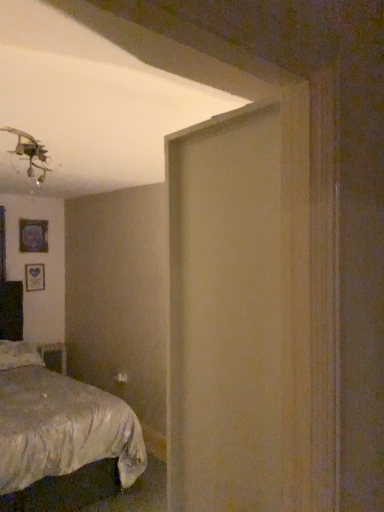
The height and width of the screenshot is (512, 384). What do you see at coordinates (33, 236) in the screenshot?
I see `matte black picture frame at upper left, the first picture frame from the top` at bounding box center [33, 236].

Measure the distance between silky white bed at lower left and camera.

The depth of silky white bed at lower left is 2.38 meters.

The width and height of the screenshot is (384, 512). Find the location of `white soft pillow at lower left`. white soft pillow at lower left is located at coordinates (19, 355).

Where is `matte black picture frame at upper left, which is counted as the second picture frame, starting from the bottom`? matte black picture frame at upper left, which is counted as the second picture frame, starting from the bottom is located at coordinates (33, 236).

Looking at this image, is silky white bed at lower left bigger than white soft pillow at lower left?

Yes.

Is silky white bed at lower left beside white soft pillow at lower left?

No, silky white bed at lower left is not in contact with white soft pillow at lower left.

Which object is closer to the camera, silky white bed at lower left or white soft pillow at lower left?

silky white bed at lower left is more forward.

Consider the image. From the image's perspective, which is above, silky white bed at lower left or white soft pillow at lower left?

silky white bed at lower left.

Looking at their sizes, would you say silky white bed at lower left is wider or thinner than wooden table at lower left?

In the image, silky white bed at lower left appears to be wider than wooden table at lower left.

Is silky white bed at lower left taller or shorter than wooden table at lower left?

silky white bed at lower left is taller than wooden table at lower left.

From a real-world perspective, is silky white bed at lower left below wooden table at lower left?

Incorrect, from a real-world perspective, silky white bed at lower left is higher than wooden table at lower left.

Can you tell me how much silky white bed at lower left and wooden table at lower left differ in facing direction?

The facing directions of silky white bed at lower left and wooden table at lower left are 0.782 degrees apart.

Is wooden picture frame at left, which appears as the first picture frame when ordered from the bottom, wider than silky white bed at lower left?

No.

In the scene shown: Is wooden picture frame at left, which appears as the first picture frame when ordered from the bottom, facing towards silky white bed at lower left?

No, wooden picture frame at left, which appears as the first picture frame when ordered from the bottom, is not facing towards silky white bed at lower left.

Which is more to the right, wooden picture frame at left, which is the second picture frame in top-to-bottom order, or silky white bed at lower left?

Positioned to the right is silky white bed at lower left.

From the image's perspective, is wooden table at lower left beneath silky white bed at lower left?

Correct, wooden table at lower left appears lower than silky white bed at lower left in the image.

The image size is (384, 512). Find the location of `bed above the wooden table at lower left (from the image's perspective)`. bed above the wooden table at lower left (from the image's perspective) is located at coordinates (62, 429).

Is white soft pillow at lower left wider than wooden picture frame at left, which is the second picture frame in top-to-bottom order?

Yes, white soft pillow at lower left is wider than wooden picture frame at left, which is the second picture frame in top-to-bottom order.

From the image's perspective, is white soft pillow at lower left over wooden picture frame at left, which appears as the first picture frame when ordered from the bottom?

Incorrect, from the image's perspective, white soft pillow at lower left is lower than wooden picture frame at left, which appears as the first picture frame when ordered from the bottom.

Is wooden picture frame at left, which is the second picture frame in top-to-bottom order, located within white soft pillow at lower left?

No.

Between white soft pillow at lower left and wooden picture frame at left, which is the second picture frame in top-to-bottom order, which one has larger size?

Bigger between the two is white soft pillow at lower left.

Find the location of `the 1st picture frame to the left of the silky white bed at lower left, starting your count from the anchor`. the 1st picture frame to the left of the silky white bed at lower left, starting your count from the anchor is located at coordinates (34, 277).

Visually, is silky white bed at lower left positioned to the left or to the right of wooden picture frame at left, which is the second picture frame in top-to-bottom order?

From the image, it's evident that silky white bed at lower left is to the right of wooden picture frame at left, which is the second picture frame in top-to-bottom order.

Does silky white bed at lower left come behind wooden picture frame at left, which appears as the first picture frame when ordered from the bottom?

No, the depth of silky white bed at lower left is less than that of wooden picture frame at left, which appears as the first picture frame when ordered from the bottom.

Which point is more forward, (29, 481) or (27, 283)?

Positioned in front is point (29, 481).

Which is in front, white soft pillow at lower left or matte black picture frame at upper left, which is counted as the second picture frame, starting from the bottom?

white soft pillow at lower left is in front.

Based on the photo, which object is wider, white soft pillow at lower left or matte black picture frame at upper left, which is counted as the second picture frame, starting from the bottom?

With larger width is white soft pillow at lower left.

Is matte black picture frame at upper left, which is counted as the second picture frame, starting from the bottom, located within white soft pillow at lower left?

Actually, matte black picture frame at upper left, which is counted as the second picture frame, starting from the bottom, is outside white soft pillow at lower left.

From the picture: Would you say white soft pillow at lower left is a long distance from matte black picture frame at upper left, the first picture frame from the top?

That's right, there is a large distance between white soft pillow at lower left and matte black picture frame at upper left, the first picture frame from the top.

You are a GUI agent. You are given a task and a screenshot of the screen. Output one action in this format:
    pyautogui.click(x=<x>, y=<y>)
    Task: Click on the pillow behind the silky white bed at lower left
    This screenshot has width=384, height=512.
    Given the screenshot: What is the action you would take?
    19,355

Where is `bed positioned vertically above the wooden table at lower left (from a real-world perspective)`? bed positioned vertically above the wooden table at lower left (from a real-world perspective) is located at coordinates (62, 429).

When comparing their distances from silky white bed at lower left, does wooden table at lower left or matte black picture frame at upper left, the first picture frame from the top, seem further?

matte black picture frame at upper left, the first picture frame from the top, is positioned further to the anchor silky white bed at lower left.

Looking at the image, which one is located closer to white soft pillow at lower left, wooden table at lower left or matte black picture frame at upper left, the first picture frame from the top?

wooden table at lower left is positioned closer to the anchor white soft pillow at lower left.

Considering their positions, is white soft pillow at lower left positioned closer to wooden table at lower left than matte black picture frame at upper left, the first picture frame from the top?

Among the two, white soft pillow at lower left is located nearer to wooden table at lower left.

When comparing their distances from matte black picture frame at upper left, which is counted as the second picture frame, starting from the bottom, does silky white bed at lower left or white soft pillow at lower left seem closer?

white soft pillow at lower left.

Based on their spatial positions, is matte black picture frame at upper left, which is counted as the second picture frame, starting from the bottom, or silky white bed at lower left closer to white soft pillow at lower left?

silky white bed at lower left.

Which object lies further to the anchor point silky white bed at lower left, wooden picture frame at left, which appears as the first picture frame when ordered from the bottom, or wooden table at lower left?

The object further to silky white bed at lower left is wooden picture frame at left, which appears as the first picture frame when ordered from the bottom.

Which object lies further to the anchor point white soft pillow at lower left, matte black picture frame at upper left, which is counted as the second picture frame, starting from the bottom, or wooden picture frame at left, which appears as the first picture frame when ordered from the bottom?

The object further to white soft pillow at lower left is matte black picture frame at upper left, which is counted as the second picture frame, starting from the bottom.

Which object lies further to the anchor point wooden picture frame at left, which is the second picture frame in top-to-bottom order, white soft pillow at lower left or silky white bed at lower left?

The object further to wooden picture frame at left, which is the second picture frame in top-to-bottom order, is silky white bed at lower left.

Where is `picture frame that lies between matte black picture frame at upper left, which is counted as the second picture frame, starting from the bottom, and wooden table at lower left from top to bottom`? The width and height of the screenshot is (384, 512). picture frame that lies between matte black picture frame at upper left, which is counted as the second picture frame, starting from the bottom, and wooden table at lower left from top to bottom is located at coordinates (34, 277).

The width and height of the screenshot is (384, 512). In order to click on picture frame between matte black picture frame at upper left, which is counted as the second picture frame, starting from the bottom, and white soft pillow at lower left vertically in this screenshot , I will do `click(34, 277)`.

Identify the location of picture frame between silky white bed at lower left and wooden table at lower left from front to back. The width and height of the screenshot is (384, 512). (33, 236).

You are a GUI agent. You are given a task and a screenshot of the screen. Output one action in this format:
    pyautogui.click(x=<x>, y=<y>)
    Task: Click on the pillow between matte black picture frame at upper left, which is counted as the second picture frame, starting from the bottom, and wooden table at lower left from top to bottom
    
    Given the screenshot: What is the action you would take?
    pyautogui.click(x=19, y=355)